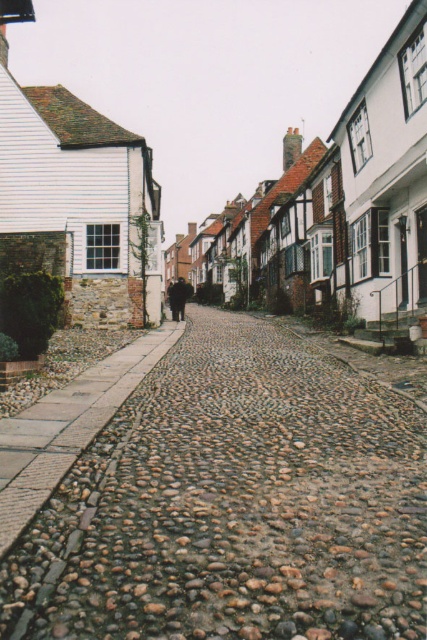
You are standing on the cobblestone street in the image. There is a point marked at coordinates (233,504). What type of surface is located at this point?

The point at coordinates (233,504) corresponds to the brown rough cobblestone at center.

You are a delivery person trying to park your 1.2 meter wide cart on the cobblestone street. You see the brown rough cobblestone at center and the white wooden house at center. Can you fit your cart between them?

The brown rough cobblestone at center is located below the white wooden house at center, so there is sufficient space between them for the cart to fit as long as the distance between them is at least 1.2 meters. However, the exact distance isn